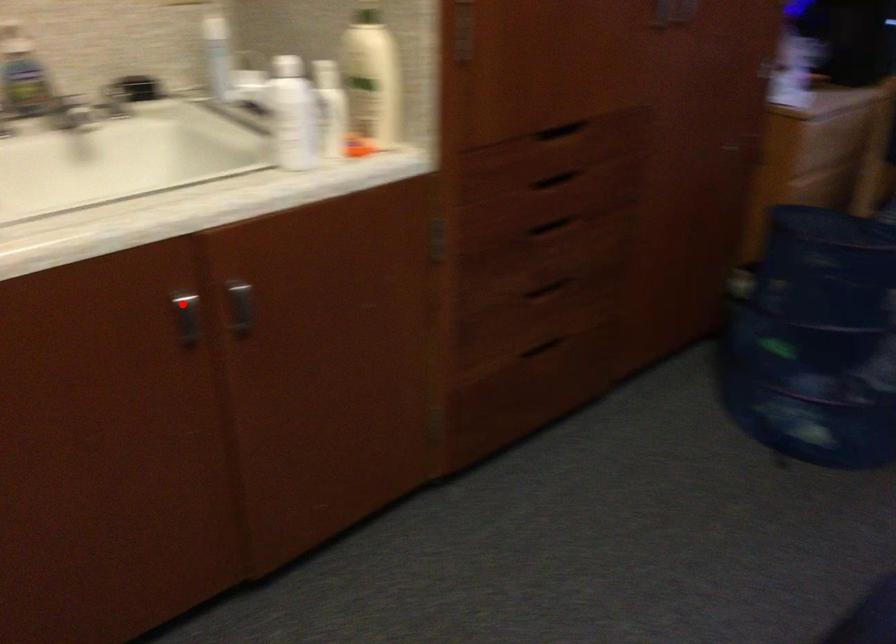
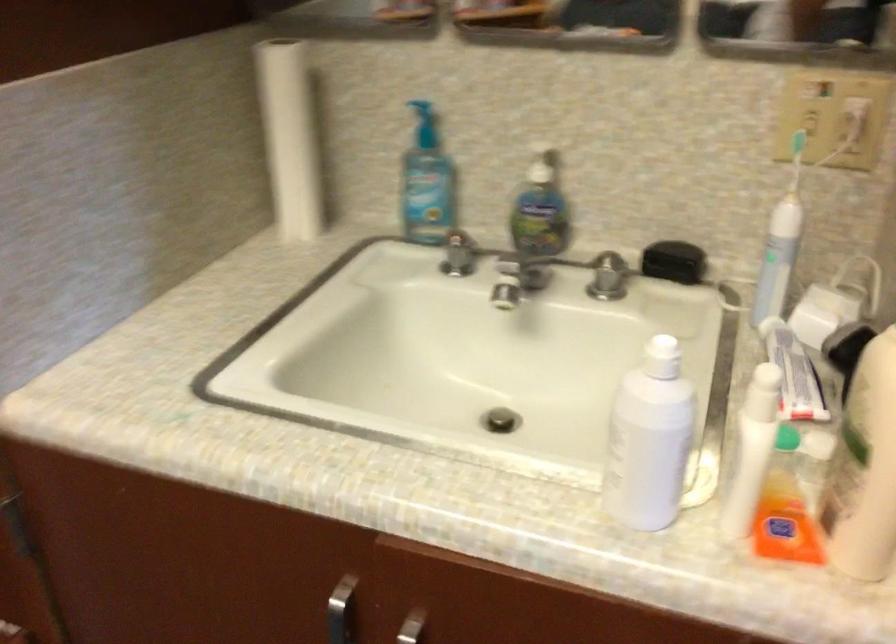
Question: I am providing you with two images of the same scene from different viewpoints. A red point is marked on the first image. Can you still see the location of the red point in image 2?

Choices:
 (A) Yes
 (B) No

Answer: (A)